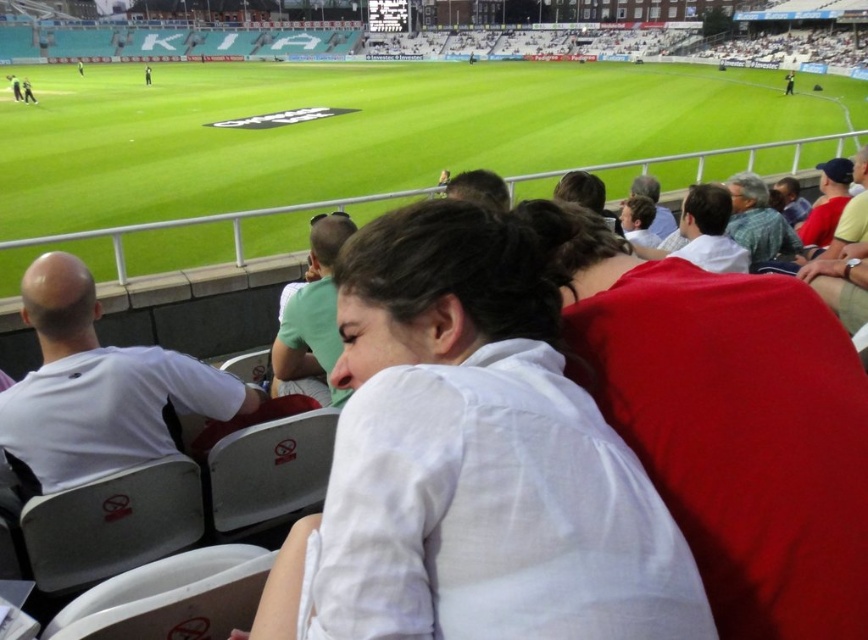
Can you confirm if white cotton shirt at center is positioned above green grass football field at center?

Incorrect, white cotton shirt at center is not positioned above green grass football field at center.

Which is below, white cotton shirt at center or green grass football field at center?

white cotton shirt at center is lower down.

Identify the location of white cotton shirt at center. (472, 461).